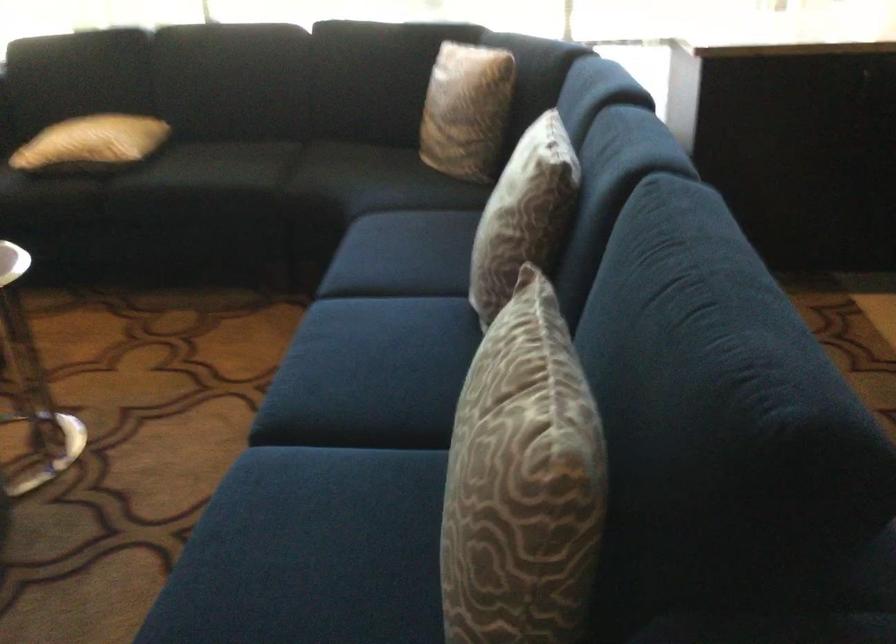
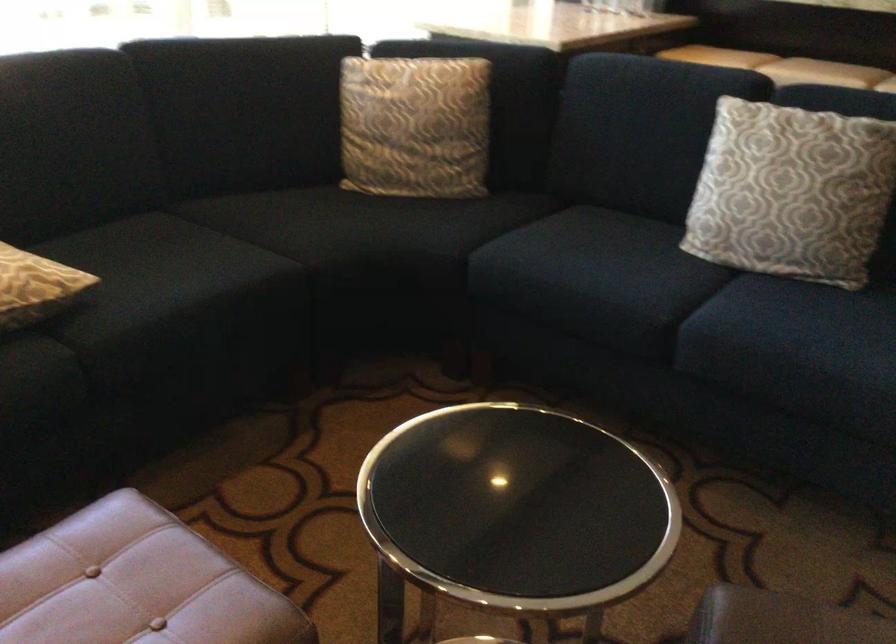
In the second image, find the point that corresponds to [364,77] in the first image.

(238, 111)